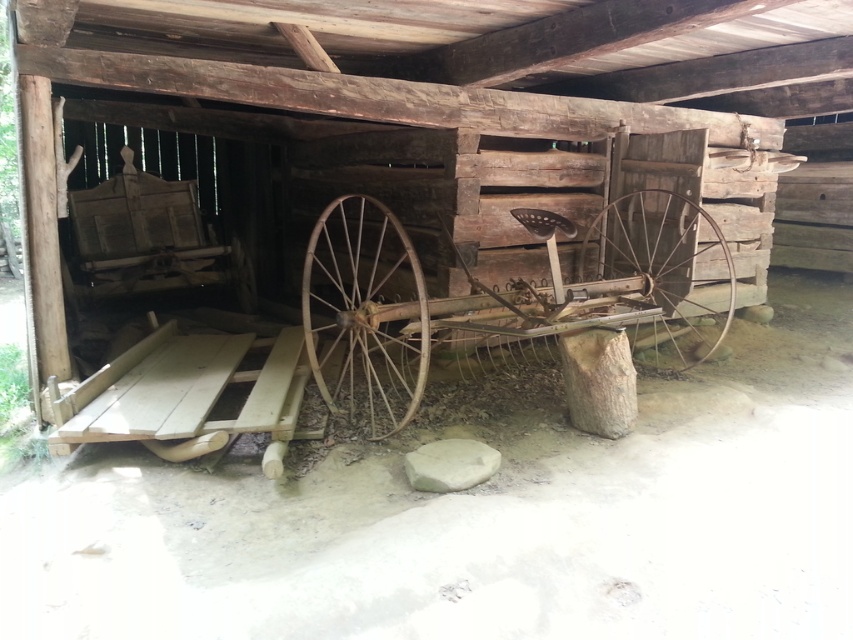
Which is in front, point (674, 216) or point (386, 269)?

Point (674, 216) is more forward.

Does rusty metal cart at center appear on the left side of rusty metal wagon wheel at center?

In fact, rusty metal cart at center is to the right of rusty metal wagon wheel at center.

Who is more forward, (345, 401) or (347, 346)?

Point (345, 401)

This screenshot has width=853, height=640. I want to click on rusty metal cart at center, so click(x=502, y=301).

Is rusty metal cart at center positioned behind rusty metal wheel at center?

That is False.

This screenshot has height=640, width=853. What do you see at coordinates (502, 301) in the screenshot?
I see `rusty metal cart at center` at bounding box center [502, 301].

You are a GUI agent. You are given a task and a screenshot of the screen. Output one action in this format:
    pyautogui.click(x=<x>, y=<y>)
    Task: Click on the rusty metal cart at center
    This screenshot has height=640, width=853.
    Given the screenshot: What is the action you would take?
    pyautogui.click(x=502, y=301)

I want to click on rusty metal cart at center, so click(502, 301).

Can you confirm if rusty metal wagon wheel at center is shorter than rusty metal wheel at center?

Incorrect, rusty metal wagon wheel at center's height does not fall short of rusty metal wheel at center's.

Who is higher up, rusty metal wagon wheel at center or rusty metal wheel at center?

Positioned higher is rusty metal wagon wheel at center.

Find the location of a particular element. The width and height of the screenshot is (853, 640). rusty metal wagon wheel at center is located at coordinates (364, 316).